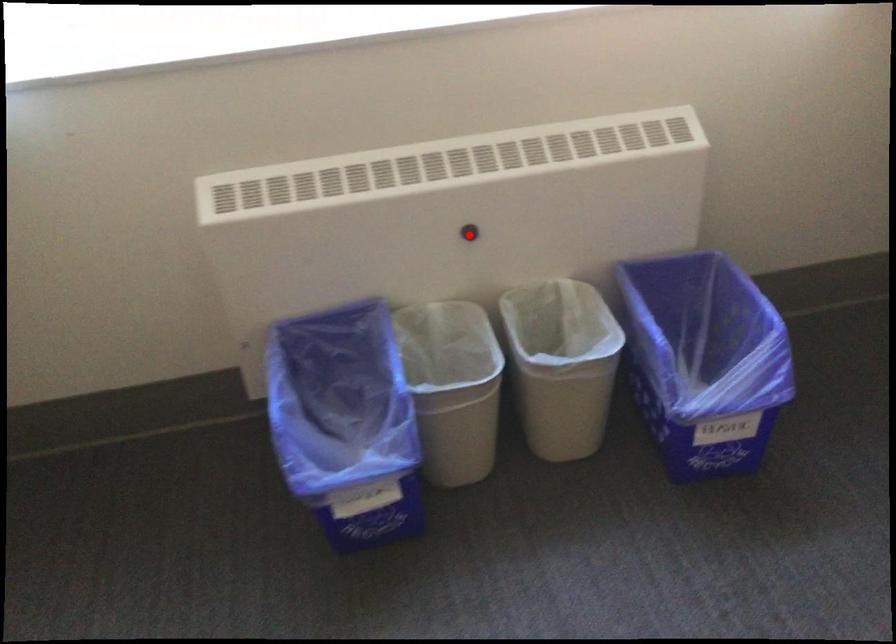
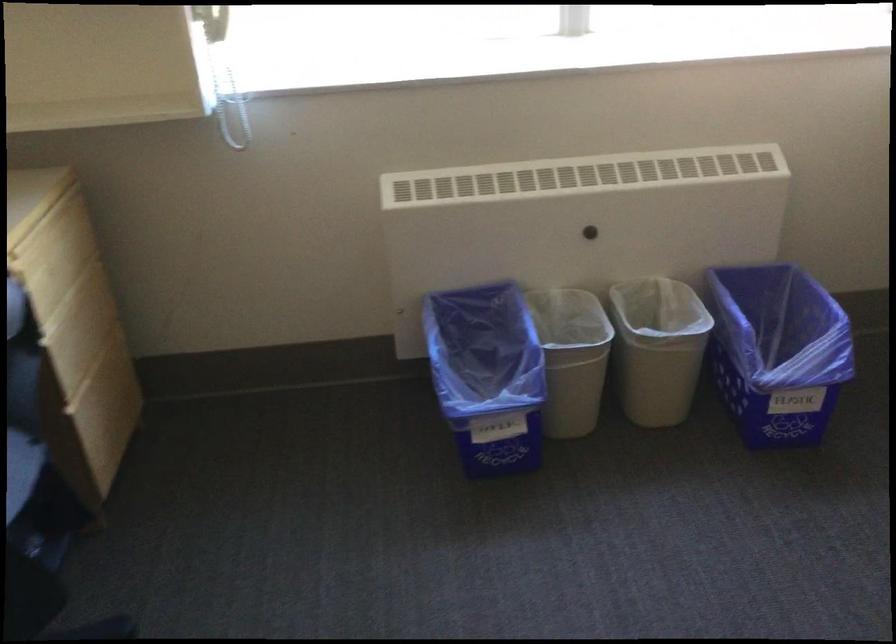
Locate, in the second image, the point that corresponds to the highlighted location in the first image.

(590, 232)